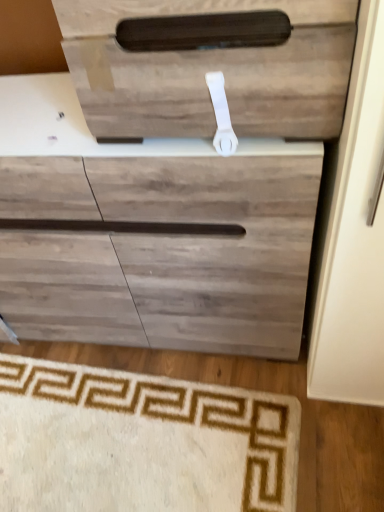
Question: Is white plastic door handle at upper center bigger than wooden drawer at upper center?

Choices:
 (A) yes
 (B) no

Answer: (B)

Question: Considering the relative sizes of white plastic door handle at upper center and wooden drawer at upper center in the image provided, is white plastic door handle at upper center thinner than wooden drawer at upper center?

Choices:
 (A) yes
 (B) no

Answer: (A)

Question: Does white plastic door handle at upper center have a lesser height compared to wooden drawer at upper center?

Choices:
 (A) no
 (B) yes

Answer: (B)

Question: Can you confirm if white plastic door handle at upper center is taller than wooden drawer at upper center?

Choices:
 (A) yes
 (B) no

Answer: (B)

Question: Is white plastic door handle at upper center next to wooden drawer at upper center?

Choices:
 (A) no
 (B) yes

Answer: (A)

Question: From a real-world perspective, is white plastic door handle at upper center located beneath wooden drawer at upper center?

Choices:
 (A) yes
 (B) no

Answer: (A)

Question: Is wooden drawer at upper center positioned with its back to white plastic door handle at upper center?

Choices:
 (A) yes
 (B) no

Answer: (B)

Question: Does wooden drawer at upper center have a greater width compared to white plastic door handle at upper center?

Choices:
 (A) yes
 (B) no

Answer: (A)

Question: Does wooden drawer at upper center have a smaller size compared to white plastic door handle at upper center?

Choices:
 (A) yes
 (B) no

Answer: (B)

Question: Is wooden drawer at upper center taller than white plastic door handle at upper center?

Choices:
 (A) yes
 (B) no

Answer: (A)

Question: Is wooden drawer at upper center beside white plastic door handle at upper center?

Choices:
 (A) no
 (B) yes

Answer: (A)

Question: From the image's perspective, does wooden drawer at upper center appear higher than white plastic door handle at upper center?

Choices:
 (A) no
 (B) yes

Answer: (B)

Question: Is wooden drawer at upper center placed right next to beige carpet at lower left?

Choices:
 (A) yes
 (B) no

Answer: (B)